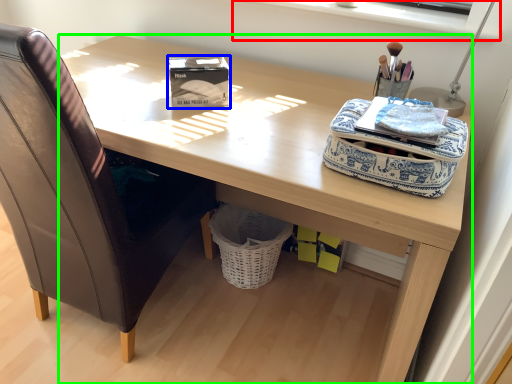
Question: Which object is positioned farthest from window sill (highlighted by a red box)? Select from box (highlighted by a blue box) and desk (highlighted by a green box).

Choices:
 (A) box
 (B) desk

Answer: (A)